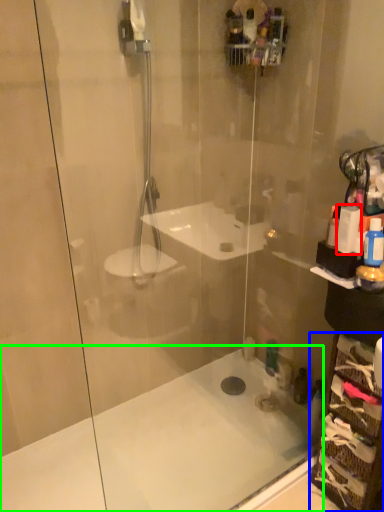
Question: Considering the real-world distances, which object is farthest from toiletry (highlighted by a red box)? glass box (highlighted by a blue box) or bath (highlighted by a green box)?

Choices:
 (A) glass box
 (B) bath

Answer: (B)